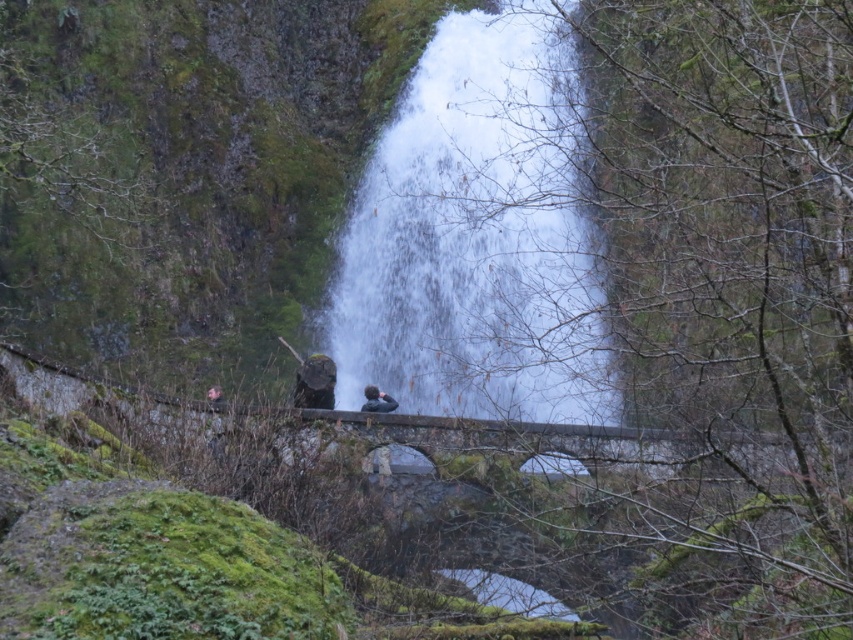
Question: Is dark gray fabric jacket at center smaller than brown leather jacket at lower left?

Choices:
 (A) no
 (B) yes

Answer: (B)

Question: Does white frothy water at center have a larger size compared to dark gray fabric jacket at center?

Choices:
 (A) yes
 (B) no

Answer: (A)

Question: Which point is closer to the camera?

Choices:
 (A) white frothy water at center
 (B) dark gray fabric jacket at center
 (C) brown leather jacket at lower left

Answer: (A)

Question: Among these points, which one is nearest to the camera?

Choices:
 (A) (486, 253)
 (B) (370, 406)

Answer: (B)

Question: Considering the real-world distances, which object is closest to the brown leather jacket at lower left?

Choices:
 (A) white frothy water at center
 (B) dark gray fabric jacket at center

Answer: (B)

Question: In this image, where is white frothy water at center located relative to brown leather jacket at lower left?

Choices:
 (A) left
 (B) right

Answer: (B)